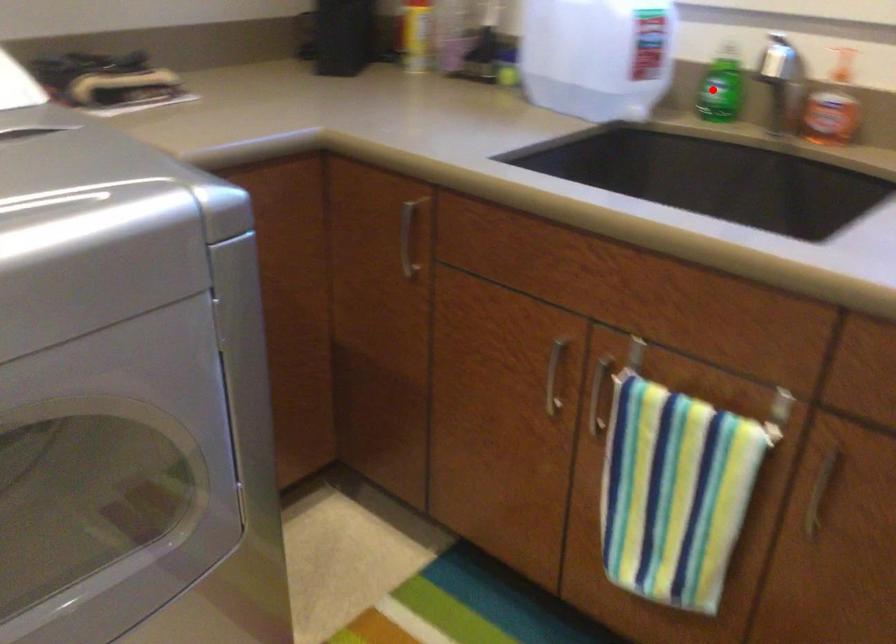
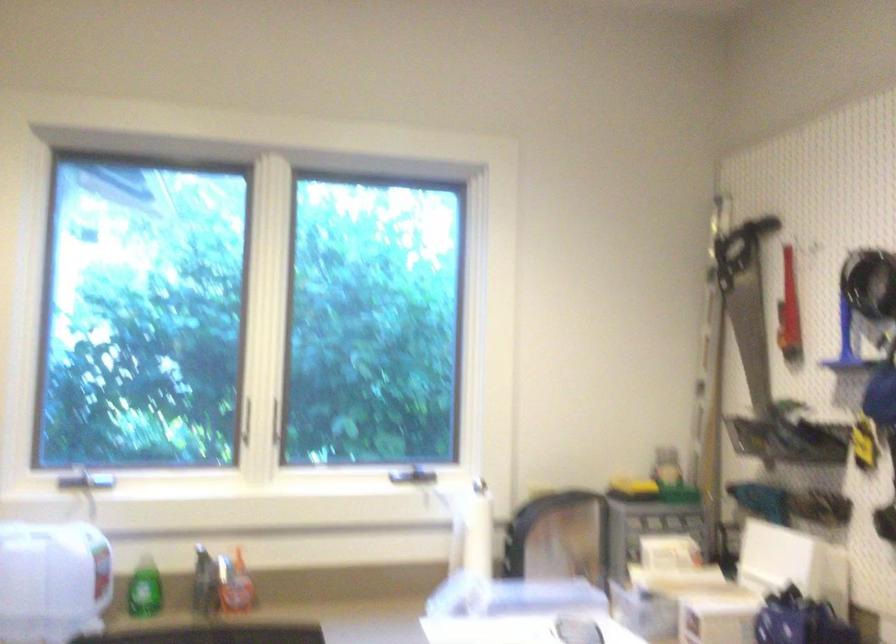
Find the pixel in the second image that matches the highlighted location in the first image.

(143, 589)